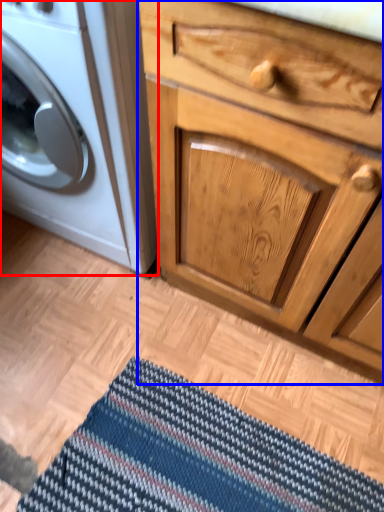
Question: Which object is closer to the camera taking this photo, washing machine (highlighted by a red box) or chest of drawers (highlighted by a blue box)?

Choices:
 (A) washing machine
 (B) chest of drawers

Answer: (B)